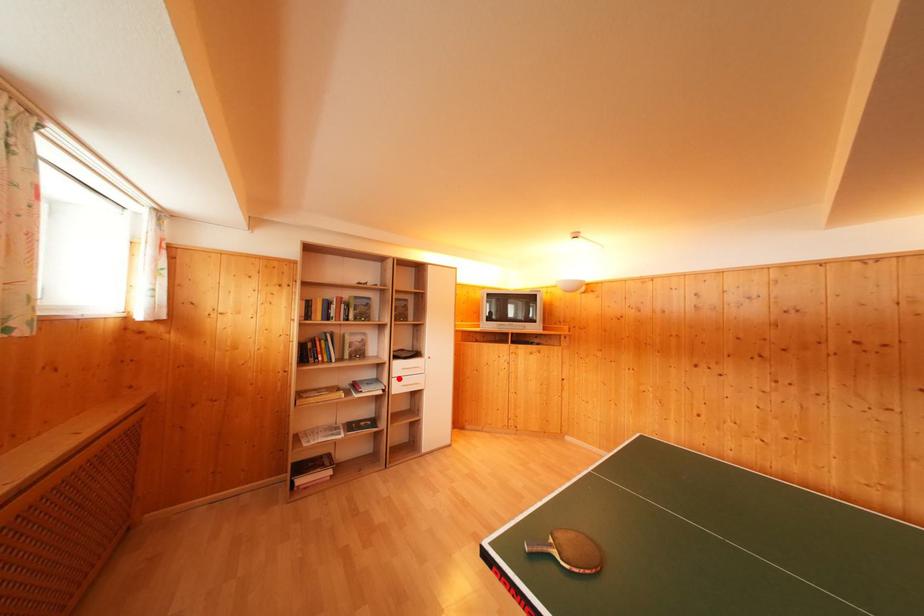
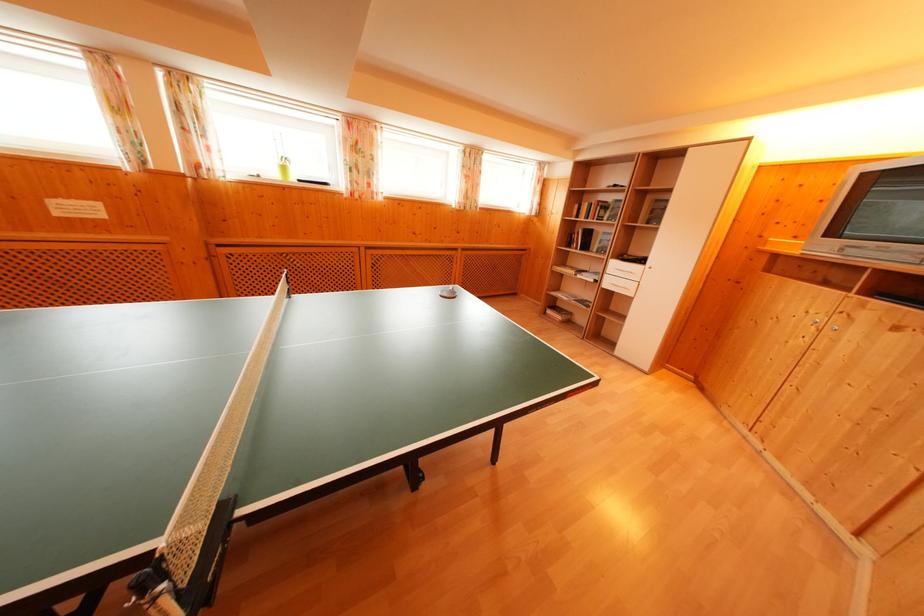
Question: I am providing you with two images of the same scene from different viewpoints. In image1, a red point is highlighted. Considering the same 3D point in image2, which of the following is correct?

Choices:
 (A) It is closer
 (B) It is farther

Answer: (A)